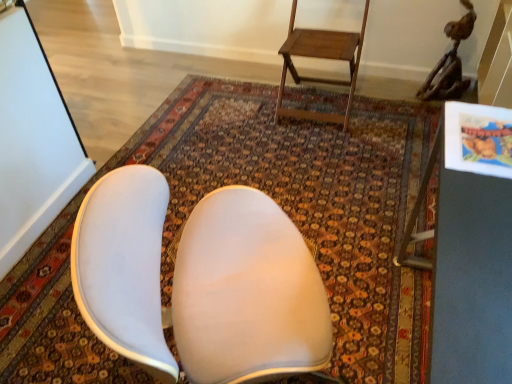
Question: Is wooden step stool at upper center bigger or smaller than metallic gray table at right?

Choices:
 (A) small
 (B) big

Answer: (A)

Question: Is wooden step stool at upper center in front of or behind metallic gray table at right in the image?

Choices:
 (A) behind
 (B) front

Answer: (A)

Question: Which object is positioned closest to the carpeted rug at center?

Choices:
 (A) metallic gray table at right
 (B) wooden step stool at upper center

Answer: (B)

Question: Based on their relative distances, which object is nearer to the carpeted rug at center?

Choices:
 (A) metallic gray table at right
 (B) wooden step stool at upper center

Answer: (B)